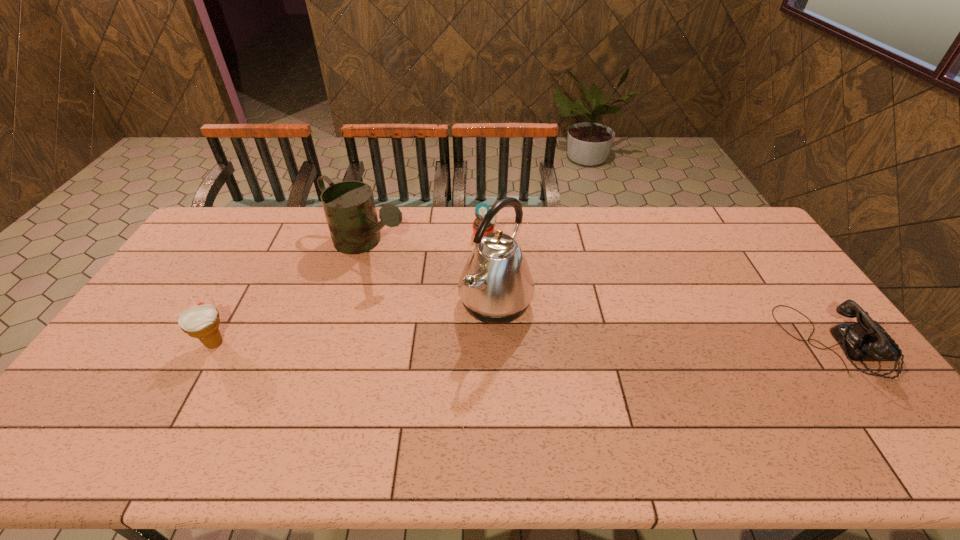
Identify the location of vacant space situated 0.240m from the spout of the kettle. (603, 359).

The width and height of the screenshot is (960, 540). I want to click on free region located 0.210m on the front-facing side of the muffin, so click(516, 276).

You are a GUI agent. You are given a task and a screenshot of the screen. Output one action in this format:
    pyautogui.click(x=<x>, y=<y>)
    Task: Click on the free spot located on the front-facing side of the muffin
    The image size is (960, 540).
    Given the screenshot: What is the action you would take?
    pyautogui.click(x=497, y=251)

I want to click on free region located 0.080m on the front-facing side of the muffin, so click(499, 253).

Identify the location of vacant space located 0.080m with the spout on the watering can. Image resolution: width=960 pixels, height=540 pixels. (413, 275).

At what (x,y) coordinates should I click in order to perform the action: click on free region located with the spout on the watering can. Please return your answer as a coordinate pair (x, y). Image resolution: width=960 pixels, height=540 pixels. Looking at the image, I should click on (447, 298).

Identify the location of vacant space located with the spout on the watering can. (445, 296).

This screenshot has height=540, width=960. I want to click on muffin that is at the far edge, so click(481, 209).

I want to click on watering can at the far edge, so click(x=349, y=206).

I want to click on object present at the near edge, so click(867, 340).